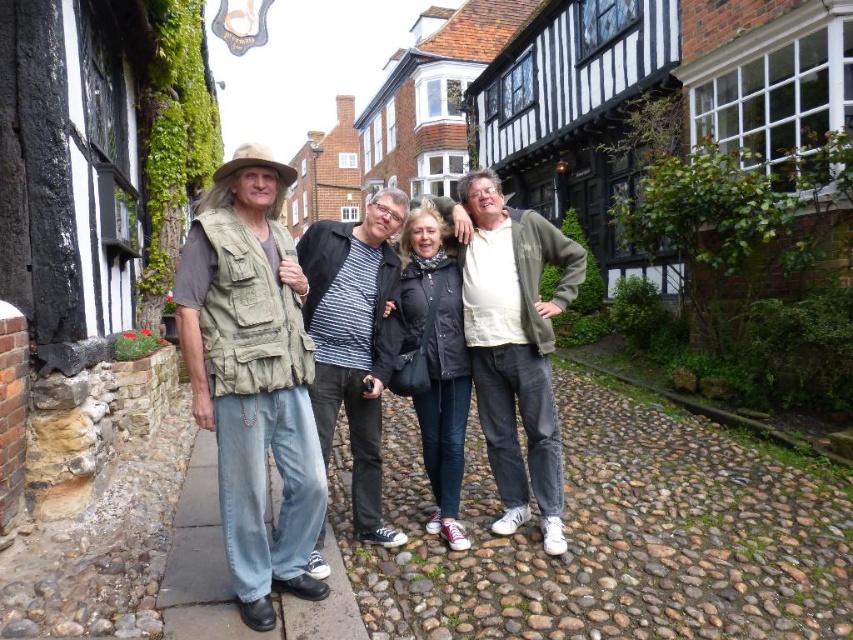
Describe the element at coordinates (253, 376) in the screenshot. This screenshot has height=640, width=853. I see `matte black jacket at center` at that location.

Between matte black jacket at center and black leather jacket at center, which one appears on the right side from the viewer's perspective?

black leather jacket at center

Identify the location of matte black jacket at center. click(x=253, y=376).

Does denim jeans at center appear over matte black jacket at center?

Correct, denim jeans at center is located above matte black jacket at center.

From the picture: Measure the distance from denim jeans at center to matte black jacket at center.

The distance of denim jeans at center from matte black jacket at center is 4.73 feet.

The width and height of the screenshot is (853, 640). What are the coordinates of `denim jeans at center` in the screenshot? It's located at (276, 369).

Does point (386, 262) come in front of point (408, 355)?

No, it is behind (408, 355).

Which is below, denim jeans at center or black leather jacket at center?

Positioned lower is black leather jacket at center.

Between point (267, 294) and point (422, 228), which one is positioned behind?

The point (422, 228) is more distant.

Locate an element on the screen. denim jeans at center is located at coordinates (276, 369).